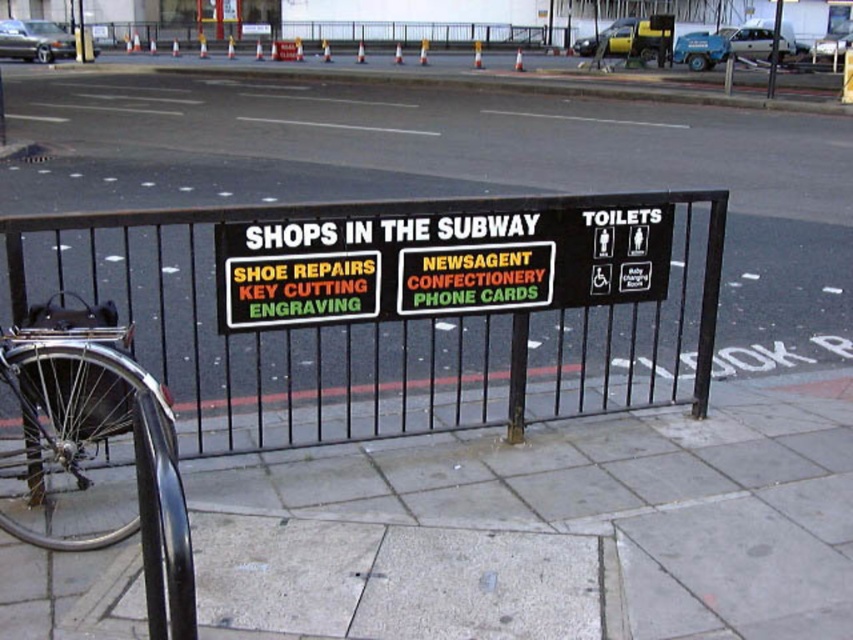
Question: Does gray concrete pavement at lower center appear over black plastic sign at center?

Choices:
 (A) yes
 (B) no

Answer: (B)

Question: Does gray concrete pavement at lower center appear under black plastic sign at center?

Choices:
 (A) no
 (B) yes

Answer: (B)

Question: Which of the following is the farthest from the observer?

Choices:
 (A) gray concrete pavement at lower center
 (B) black plastic sign at center

Answer: (B)

Question: Which object is farther from the camera taking this photo?

Choices:
 (A) polished chrome bicycle at lower left
 (B) black metal fence at center
 (C) black plastic sign at center
 (D) gray concrete pavement at lower center

Answer: (B)

Question: Which object is the farthest from the gray concrete pavement at lower center?

Choices:
 (A) black plastic sign at center
 (B) polished chrome bicycle at lower left
 (C) black metal fence at center

Answer: (C)

Question: Is black metal fence at center positioned before polished chrome bicycle at lower left?

Choices:
 (A) yes
 (B) no

Answer: (B)